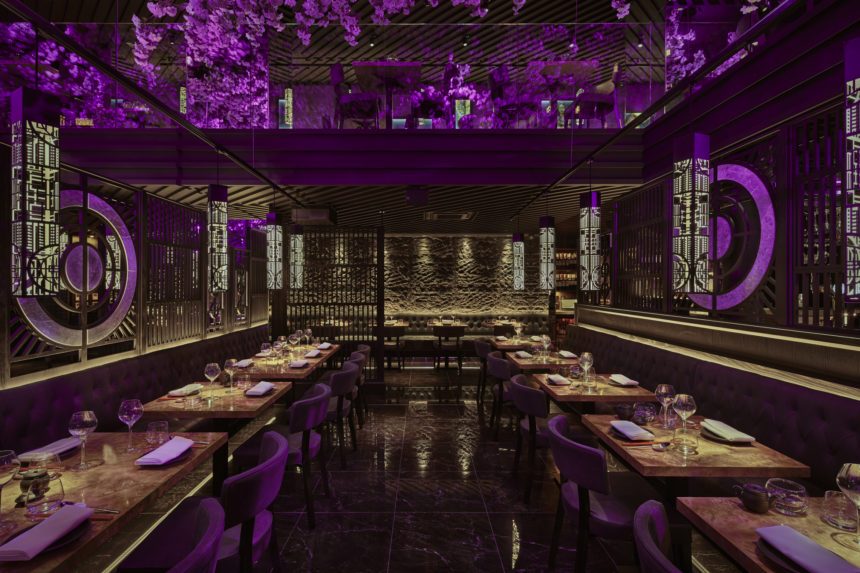
The image size is (860, 573). In order to click on leftmost table in this screenshot , I will do tap(100, 488).